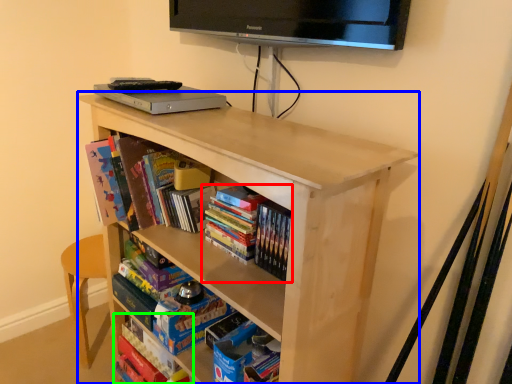
Question: Which object is positioned farthest from book (highlighted by a red box)? Select from shelf (highlighted by a blue box) and book (highlighted by a green box).

Choices:
 (A) shelf
 (B) book

Answer: (B)